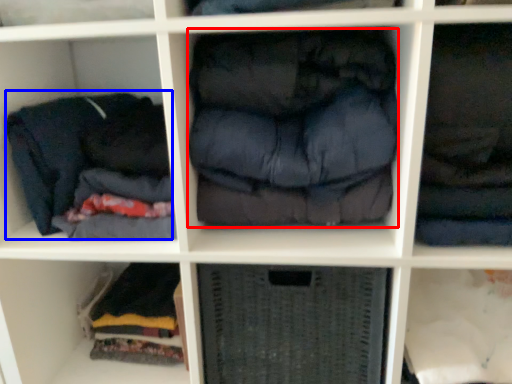
Question: Which object appears farthest to the camera in this image, clothing (highlighted by a red box) or clothing (highlighted by a blue box)?

Choices:
 (A) clothing
 (B) clothing

Answer: (B)